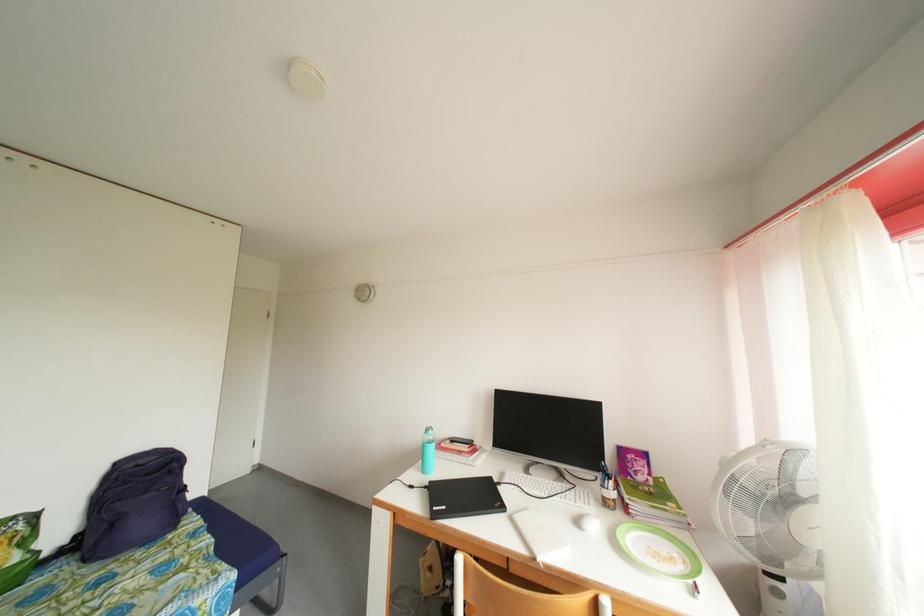
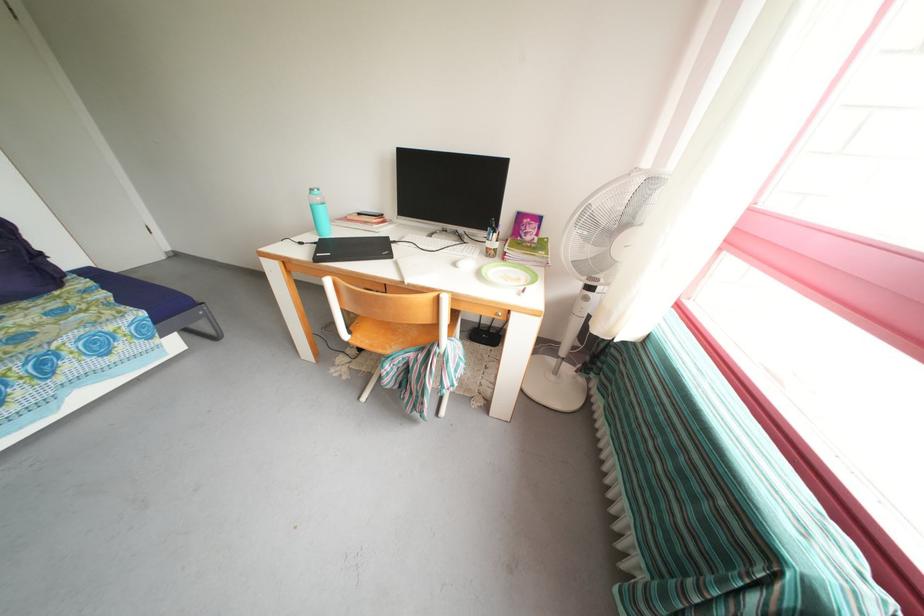
The point at (642, 477) is marked in the first image. Where is the corresponding point in the second image?

(532, 238)